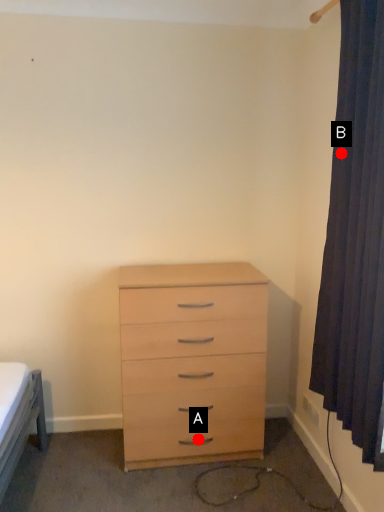
Question: Two points are circled on the image, labeled by A and B beside each circle. Which point is closer to the camera?

Choices:
 (A) A is closer
 (B) B is closer

Answer: (B)